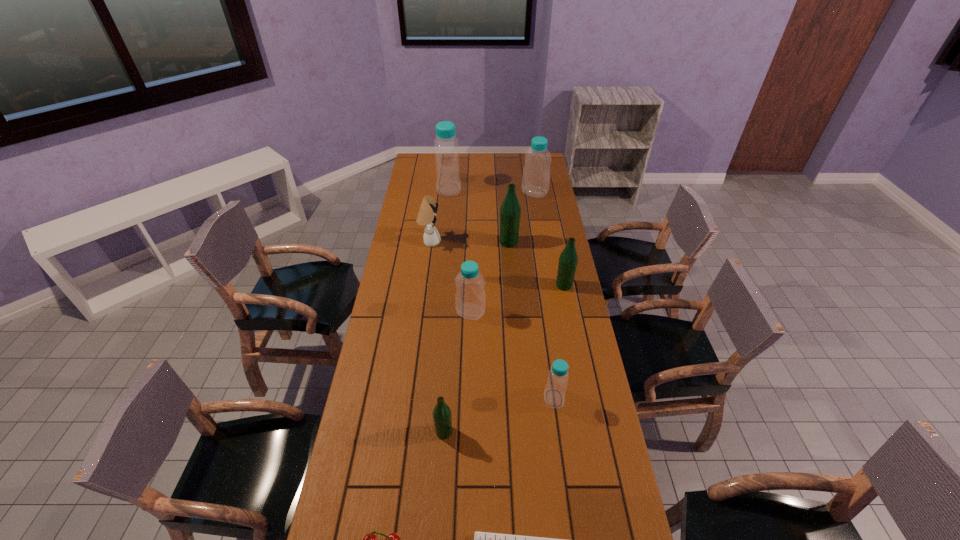
Where is `the smallest green bottle`? Image resolution: width=960 pixels, height=540 pixels. the smallest green bottle is located at coordinates (442, 416).

The height and width of the screenshot is (540, 960). Find the location of `the leftmost green bottle`. the leftmost green bottle is located at coordinates (442, 416).

Find the location of a particular element. This screenshot has height=540, width=960. the seventh farthest object is located at coordinates (554, 394).

Locate an element on the screen. the nearest blue bottle is located at coordinates (x=554, y=394).

Image resolution: width=960 pixels, height=540 pixels. In order to click on vacant space located on the right of the tallest bottle in this screenshot , I will do pos(480,190).

Identify the location of free region located 0.240m on the left of the second biggest blue bottle. This screenshot has width=960, height=540. coord(476,193).

Locate an element on the screen. free location located on the left of the biggest green bottle is located at coordinates (416, 242).

Locate an element on the screen. vacant area situated 0.120m at the front face of the black doll is located at coordinates (468, 242).

Image resolution: width=960 pixels, height=540 pixels. In order to click on free space located 0.350m on the back of the fifth nearest object in this screenshot , I will do `click(472, 247)`.

I want to click on free space located on the left of the fourth farthest bottle, so click(x=461, y=285).